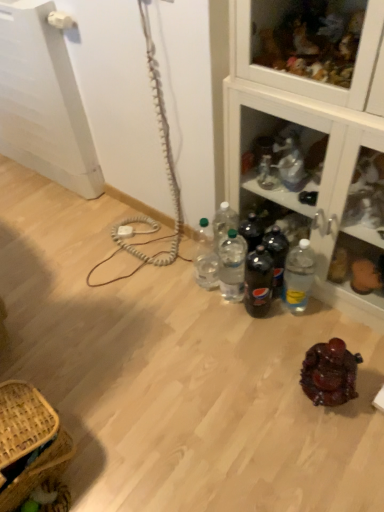
Find the location of a particular element. The height and width of the screenshot is (512, 384). free space behind shiny brown candy at center is located at coordinates (302, 334).